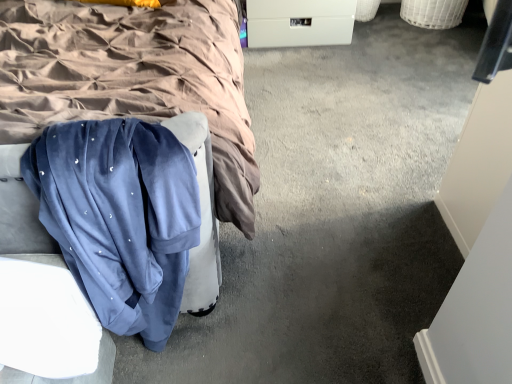
Question: Can you confirm if velvet blue sweatpants at lower left is bigger than white plastic drawer at center?

Choices:
 (A) no
 (B) yes

Answer: (A)

Question: Is velvet blue sweatpants at lower left thinner than white plastic drawer at center?

Choices:
 (A) yes
 (B) no

Answer: (A)

Question: Is velvet blue sweatpants at lower left facing towards white plastic drawer at center?

Choices:
 (A) yes
 (B) no

Answer: (B)

Question: Can you see velvet blue sweatpants at lower left touching white plastic drawer at center?

Choices:
 (A) yes
 (B) no

Answer: (B)

Question: Is the depth of velvet blue sweatpants at lower left greater than that of white plastic drawer at center?

Choices:
 (A) yes
 (B) no

Answer: (B)

Question: Considering the positions of velvet blue sweatpants at lower left and white plastic drawer at center in the image, is velvet blue sweatpants at lower left bigger or smaller than white plastic drawer at center?

Choices:
 (A) big
 (B) small

Answer: (B)

Question: From the image's perspective, is velvet blue sweatpants at lower left located above or below white plastic drawer at center?

Choices:
 (A) below
 (B) above

Answer: (A)

Question: From a real-world perspective, is velvet blue sweatpants at lower left physically located above or below white plastic drawer at center?

Choices:
 (A) below
 (B) above

Answer: (B)

Question: Is velvet blue sweatpants at lower left spatially inside white plastic drawer at center, or outside of it?

Choices:
 (A) inside
 (B) outside

Answer: (B)

Question: In terms of height, does white plastic drawer at center look taller or shorter compared to velvet blue sweatpants at lower left?

Choices:
 (A) short
 (B) tall

Answer: (A)

Question: In terms of width, does white plastic drawer at center look wider or thinner when compared to velvet blue sweatpants at lower left?

Choices:
 (A) wide
 (B) thin

Answer: (A)

Question: In terms of size, does white plastic drawer at center appear bigger or smaller than velvet blue sweatpants at lower left?

Choices:
 (A) big
 (B) small

Answer: (A)

Question: From a real-world perspective, is white plastic drawer at center physically located above or below velvet blue sweatpants at lower left?

Choices:
 (A) below
 (B) above

Answer: (A)

Question: From the image's perspective, relative to velvet blue sweatpants at lower left, is velvet blue blanket at center above or below?

Choices:
 (A) above
 (B) below

Answer: (A)

Question: Is velvet blue blanket at center taller or shorter than velvet blue sweatpants at lower left?

Choices:
 (A) short
 (B) tall

Answer: (B)